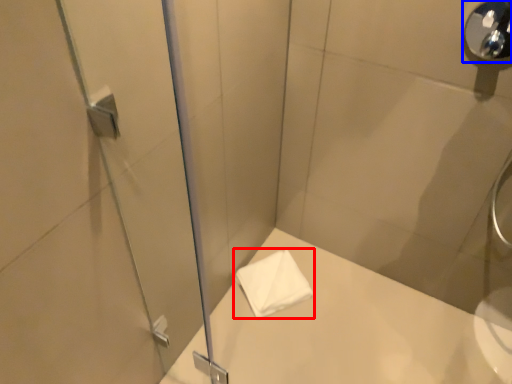
Question: Which object is closer to the camera taking this photo, towel (highlighted by a red box) or shower (highlighted by a blue box)?

Choices:
 (A) towel
 (B) shower

Answer: (B)